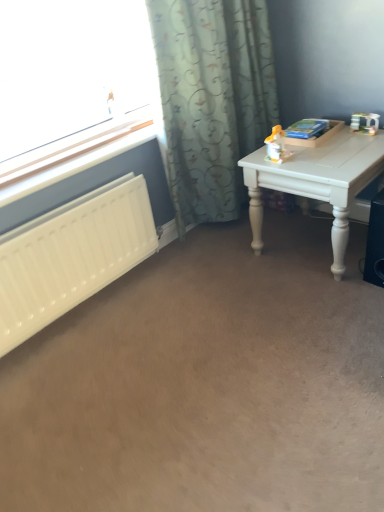
At what (x,y) coordinates should I click in order to perform the action: click on free location in front of yellow plastic toy at upper right. Please return your answer as a coordinate pair (x, y). This screenshot has height=512, width=384. Looking at the image, I should click on (298, 166).